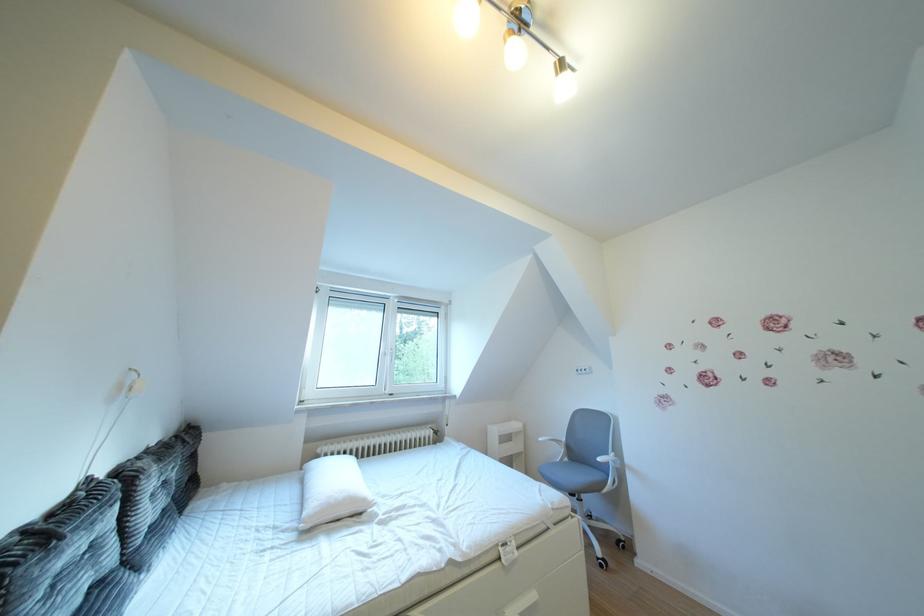
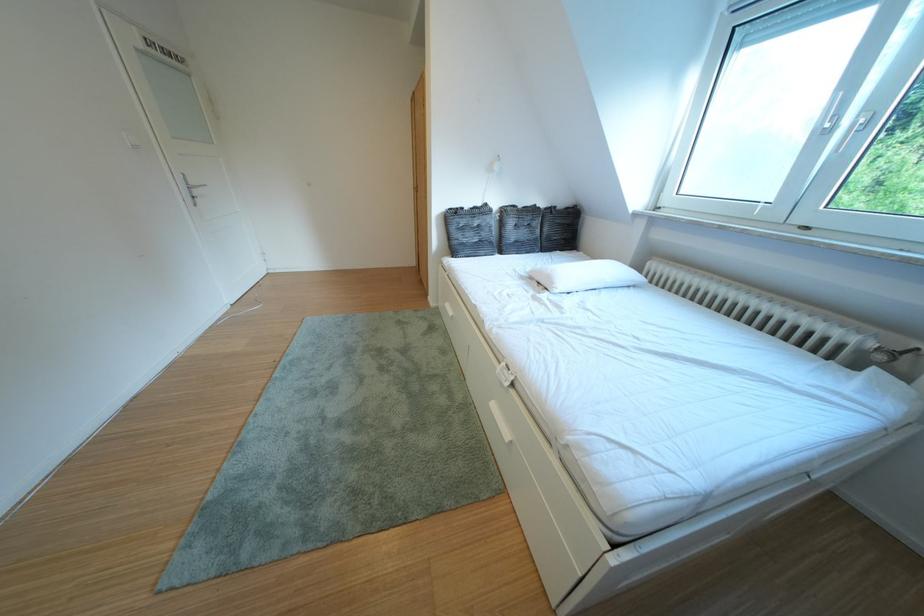
Find the pixel in the second image that matches the point at 378,505 in the first image.

(565, 288)